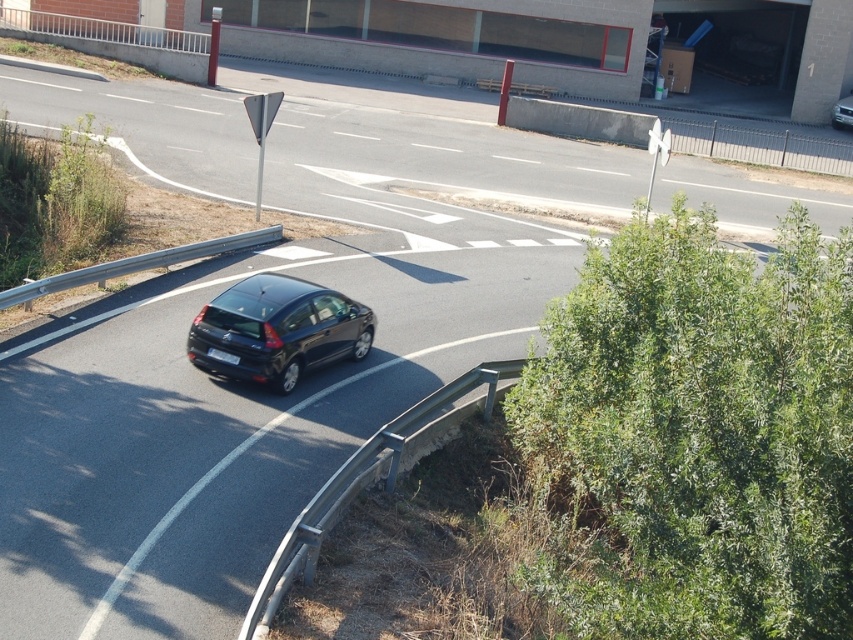
You are standing at the edge of the road and want to throw a ball to a friend who is standing 25 meters away from you. Can you reach your friend by throwing the ball along the smooth asphalt road at center?

The smooth asphalt road at center is 24.96 meters from viewer, so yes, you can reach your friend by throwing the ball along the smooth asphalt road at center since the distance is just slightly less than 25 meters.

You are a drone operator trying to locate the smooth asphalt road at center in the image. According to the coordinates provided, where would you find it?

The smooth asphalt road at center is located at the 2D coordinates point of (444, 156).

You are a driver in the glossy black hatchback at center. You need to know if you can safely pass under a low clearance sign that is at the same height as the smooth asphalt road at center. Can you safely pass under it?

The smooth asphalt road at center has a greater height compared to the glossy black hatchback at center, so yes, you can safely pass under the low clearance sign at the same height as the road because the road is taller than the car.